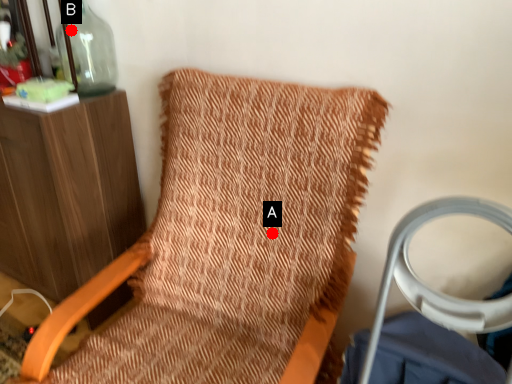
Question: Two points are circled on the image, labeled by A and B beside each circle. Which point is farther to the camera?

Choices:
 (A) A is further
 (B) B is further

Answer: (B)